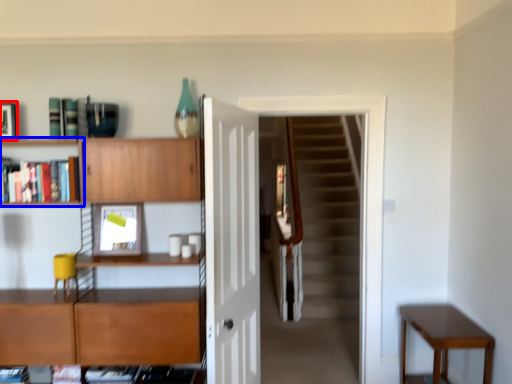
Question: Which point is closer to the camera, picture frame (highlighted by a red box) or shelf (highlighted by a blue box)?

Choices:
 (A) picture frame
 (B) shelf

Answer: (B)